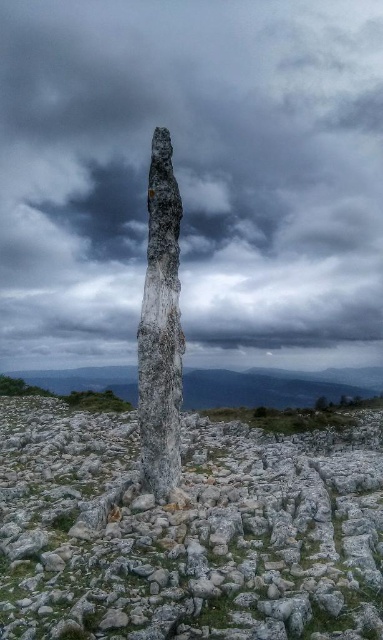
Question: Does gray cloudy sky at upper center have a larger size compared to white stone pillar at center?

Choices:
 (A) yes
 (B) no

Answer: (A)

Question: Is gray cloudy sky at upper center above white stone pillar at center?

Choices:
 (A) no
 (B) yes

Answer: (B)

Question: Which point is closer to the camera?

Choices:
 (A) coord(98,637)
 (B) coord(279,262)

Answer: (A)

Question: Which point appears farthest from the camera in this image?

Choices:
 (A) (369, 627)
 (B) (65, 253)

Answer: (B)

Question: Does gray cloudy sky at upper center appear on the right side of white stone pillar at center?

Choices:
 (A) yes
 (B) no

Answer: (A)

Question: Among these objects, which one is nearest to the camera?

Choices:
 (A) gray cloudy sky at upper center
 (B) white stone pillar at center

Answer: (B)